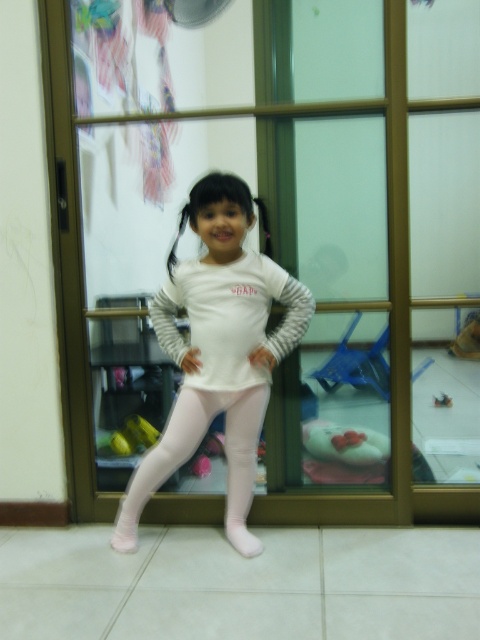
You are a fashion designer looking at the image of the girl wearing white matte leggings at center and white striped sweatshirt at center. Which piece of clothing is positioned to the left side of the other?

The white matte leggings at center are to the left of the white striped sweatshirt at center.

Based on the photo, you are trying to locate the white striped sweatshirt at center in the room. Based on the coordinates provided, where would you find it?

The white striped sweatshirt at center is located at the coordinates point (229, 317), which is near the center of the room.

You are a fashion designer analyzing the image. You need to determine which clothing item takes up more space in the visual composition. The items are the white matte leggings at center and the white striped sweatshirt at center. Which one is larger?

The white matte leggings at center is bigger than the white striped sweatshirt at center, so the leggings take up more space in the visual composition.